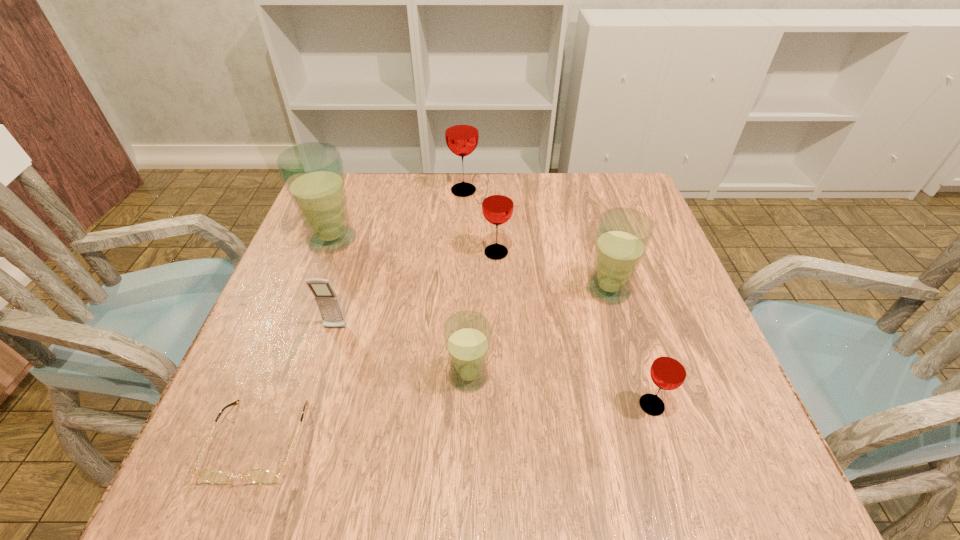
At what (x,y) coordinates should I click in order to perform the action: click on the smallest blue glass. Please return your answer as a coordinate pair (x, y). Image resolution: width=960 pixels, height=540 pixels. Looking at the image, I should click on pos(467,334).

The height and width of the screenshot is (540, 960). Find the location of `the nearest blue glass`. the nearest blue glass is located at coordinates (467, 334).

This screenshot has width=960, height=540. I want to click on the nearest red glass, so click(668, 371).

Image resolution: width=960 pixels, height=540 pixels. I want to click on the rightmost red glass, so click(668, 371).

Locate an element on the screen. This screenshot has height=540, width=960. spectacles is located at coordinates (258, 476).

You are a GUI agent. You are given a task and a screenshot of the screen. Output one action in this format:
    pyautogui.click(x=<x>, y=<y>)
    Task: Click on the green spectacles
    The image size is (960, 540).
    Given the screenshot: What is the action you would take?
    pyautogui.click(x=258, y=476)

Where is `vacant space located 0.130m on the right of the farthest red glass`? vacant space located 0.130m on the right of the farthest red glass is located at coordinates (526, 191).

Find the location of a particular element. free space located 0.380m on the front of the leftmost blue glass is located at coordinates (270, 403).

In order to click on free region located 0.080m on the back of the second smallest red glass in this screenshot , I will do `click(495, 223)`.

Where is `free space located 0.260m on the left of the fourth farthest glass`? This screenshot has height=540, width=960. free space located 0.260m on the left of the fourth farthest glass is located at coordinates (464, 289).